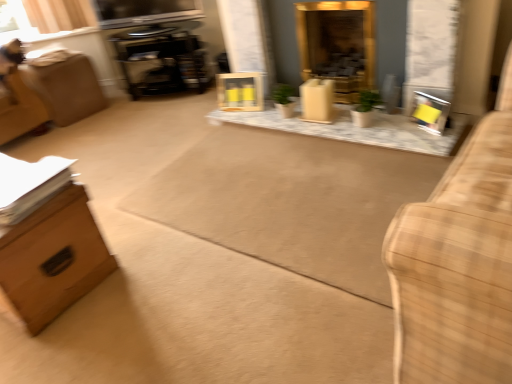
Question: Is brown cardboard box at left completely or partially inside wooden swivel chair at left?

Choices:
 (A) no
 (B) yes

Answer: (A)

Question: Is wooden swivel chair at left wider than brown cardboard box at left?

Choices:
 (A) yes
 (B) no

Answer: (A)

Question: Are wooden swivel chair at left and brown cardboard box at left far apart?

Choices:
 (A) no
 (B) yes

Answer: (B)

Question: From the image's perspective, is wooden swivel chair at left under brown cardboard box at left?

Choices:
 (A) no
 (B) yes

Answer: (A)

Question: Is wooden swivel chair at left bigger than brown cardboard box at left?

Choices:
 (A) no
 (B) yes

Answer: (B)

Question: Is plaid fabric couch at right wider or thinner than matte wood box at center?

Choices:
 (A) thin
 (B) wide

Answer: (B)

Question: From the image's perspective, relative to matte wood box at center, is plaid fabric couch at right above or below?

Choices:
 (A) above
 (B) below

Answer: (B)

Question: From a real-world perspective, is plaid fabric couch at right positioned above or below matte wood box at center?

Choices:
 (A) below
 (B) above

Answer: (B)

Question: Which is correct: plaid fabric couch at right is inside matte wood box at center, or outside of it?

Choices:
 (A) outside
 (B) inside

Answer: (A)

Question: From a real-world perspective, relative to black glossy entertainment center at upper left, is plaid fabric couch at right vertically above or below?

Choices:
 (A) above
 (B) below

Answer: (A)

Question: Looking at the image, does plaid fabric couch at right seem bigger or smaller compared to black glossy entertainment center at upper left?

Choices:
 (A) small
 (B) big

Answer: (B)

Question: Do you think plaid fabric couch at right is within black glossy entertainment center at upper left, or outside of it?

Choices:
 (A) outside
 (B) inside

Answer: (A)

Question: From the image's perspective, is plaid fabric couch at right positioned above or below black glossy entertainment center at upper left?

Choices:
 (A) below
 (B) above

Answer: (A)

Question: Would you say yellow cardboard picture frame at right, the 2th picture frame viewed from the left, is inside or outside wooden frame at center, placed as the 2th picture frame when sorted from bottom to top?

Choices:
 (A) inside
 (B) outside

Answer: (B)

Question: Would you say yellow cardboard picture frame at right, marked as the 1th picture frame in a right-to-left arrangement, is to the left or to the right of wooden frame at center, the first picture frame positioned from the left, in the picture?

Choices:
 (A) left
 (B) right

Answer: (B)